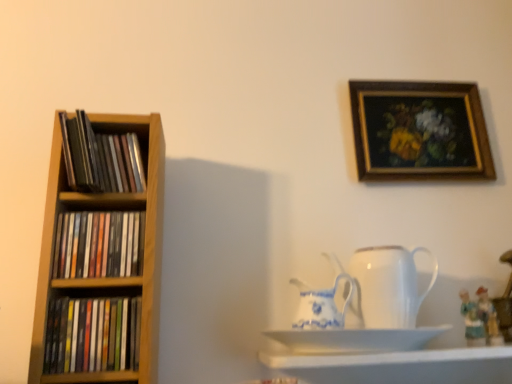
Describe the element at coordinates (93, 335) in the screenshot. I see `matte black books at left, which appears as the third book when viewed from the top` at that location.

In order to face white ceramic saucer at lower center, should I rotate leftwards or rightwards?

Rotate your view right by about 14.285°.

The width and height of the screenshot is (512, 384). What do you see at coordinates (488, 317) in the screenshot? I see `matte ceramic figurine at lower right, which appears as the 2th toy when viewed from the left` at bounding box center [488, 317].

What do you see at coordinates (320, 306) in the screenshot? This screenshot has height=384, width=512. I see `white porcelain jug at center, the 2th jug in the right-to-left sequence` at bounding box center [320, 306].

What is the approximate width of matte wooden shelf at left, which appears as the second book when viewed from the top?

The width of matte wooden shelf at left, which appears as the second book when viewed from the top, is 6.24 centimeters.

This screenshot has width=512, height=384. Describe the element at coordinates (100, 158) in the screenshot. I see `matte black books at left, the third book positioned from the bottom` at that location.

Image resolution: width=512 pixels, height=384 pixels. I want to click on matte black books at left, which ranks as the first book in bottom-to-top order, so click(x=93, y=335).

You are a GUI agent. You are given a task and a screenshot of the screen. Output one action in this format:
    pyautogui.click(x=<x>, y=<y>)
    Task: Click on the shelf that is below the white porcelain jug at center, positioned as the second jug in left-to-right order (from the image's perspective)
    This screenshot has height=384, width=512.
    Given the screenshot: What is the action you would take?
    pyautogui.click(x=398, y=366)

Could you tell me if white porcelain jug at center, which is counted as the first jug, starting from the right, is facing white glossy shelf at lower center?

No, white porcelain jug at center, which is counted as the first jug, starting from the right, does not turn towards white glossy shelf at lower center.

Is white porcelain jug at center, positioned as the second jug in left-to-right order, taller than white glossy shelf at lower center?

Correct, white porcelain jug at center, positioned as the second jug in left-to-right order, is much taller as white glossy shelf at lower center.

Would you say white glossy shelf at lower center is part of white porcelain jug at center, which is counted as the first jug, starting from the right,'s contents?

No, white glossy shelf at lower center is not a part of white porcelain jug at center, which is counted as the first jug, starting from the right.

How many degrees apart are the facing directions of wooden framed painting at upper right and matte ceramic figurine at lower right, placed as the first toy when sorted from right to left?

The angle between the facing direction of wooden framed painting at upper right and the facing direction of matte ceramic figurine at lower right, placed as the first toy when sorted from right to left, is 1.46 degrees.

Which object is positioned more to the right, wooden framed painting at upper right or matte ceramic figurine at lower right, which appears as the 2th toy when viewed from the left?

Positioned to the right is matte ceramic figurine at lower right, which appears as the 2th toy when viewed from the left.

Is matte ceramic figurine at lower right, placed as the first toy when sorted from right to left, at the back of wooden framed painting at upper right?

No.

Is matte black books at left, positioned as the first book in top-to-bottom order, taller than wooden framed painting at upper right?

In fact, matte black books at left, positioned as the first book in top-to-bottom order, may be shorter than wooden framed painting at upper right.

Considering the relative positions of matte black books at left, the third book positioned from the bottom, and wooden framed painting at upper right in the image provided, is matte black books at left, the third book positioned from the bottom, to the left of wooden framed painting at upper right from the viewer's perspective?

Yes.

Can you confirm if matte black books at left, the third book positioned from the bottom, is smaller than wooden framed painting at upper right?

Indeed, matte black books at left, the third book positioned from the bottom, has a smaller size compared to wooden framed painting at upper right.

Is matte black books at left, the third book positioned from the bottom, behind wooden framed painting at upper right?

Answer: No.

Is matte black books at left, positioned as the first book in top-to-bottom order, to the left of matte black books at left, which appears as the third book when viewed from the top, from the viewer's perspective?

In fact, matte black books at left, positioned as the first book in top-to-bottom order, is to the right of matte black books at left, which appears as the third book when viewed from the top.

From a real-world perspective, is matte black books at left, the third book positioned from the bottom, positioned over matte black books at left, which ranks as the first book in bottom-to-top order, based on gravity?

Yes, from a real-world perspective, matte black books at left, the third book positioned from the bottom, is on top of matte black books at left, which ranks as the first book in bottom-to-top order.

Is matte black books at left, the third book positioned from the bottom, wider than matte black books at left, which appears as the third book when viewed from the top?

Indeed, matte black books at left, the third book positioned from the bottom, has a greater width compared to matte black books at left, which appears as the third book when viewed from the top.

Is matte black books at left, the third book positioned from the bottom, situated inside matte black books at left, which ranks as the first book in bottom-to-top order, or outside?

matte black books at left, the third book positioned from the bottom, cannot be found inside matte black books at left, which ranks as the first book in bottom-to-top order.

From a real-world perspective, which object rests below the other?

matte ceramic figurine at lower right, which is the second toy in right-to-left order.

Does matte ceramic figurine at lower right, which is the second toy in right-to-left order, have a greater width compared to white porcelain jug at center, the 2th jug in the right-to-left sequence?

No, matte ceramic figurine at lower right, which is the second toy in right-to-left order, is not wider than white porcelain jug at center, the 2th jug in the right-to-left sequence.

From the picture: From the image's perspective, is matte ceramic figurine at lower right, which is the second toy in right-to-left order, beneath white porcelain jug at center, the first jug in the left-to-right sequence?

Correct, matte ceramic figurine at lower right, which is the second toy in right-to-left order, appears lower than white porcelain jug at center, the first jug in the left-to-right sequence, in the image.

Is the surface of matte ceramic figurine at lower right, which is the second toy in right-to-left order, in direct contact with white porcelain jug at center, the 2th jug in the right-to-left sequence?

There is a gap between matte ceramic figurine at lower right, which is the second toy in right-to-left order, and white porcelain jug at center, the 2th jug in the right-to-left sequence.

In the scene shown: Which of these two, matte ceramic figurine at lower right, which is the second toy in right-to-left order, or white ceramic saucer at lower center, is bigger?

white ceramic saucer at lower center.

The image size is (512, 384). Identify the location of saucer located in front of the matte ceramic figurine at lower right, which is the first toy in left-to-right order. (355, 339).

From a real-world perspective, which is physically above, matte ceramic figurine at lower right, which is the first toy in left-to-right order, or white ceramic saucer at lower center?

From a 3D spatial view, matte ceramic figurine at lower right, which is the first toy in left-to-right order, is above.

Is matte ceramic figurine at lower right, which is the second toy in right-to-left order, outside of white ceramic saucer at lower center?

That's correct, matte ceramic figurine at lower right, which is the second toy in right-to-left order, is outside of white ceramic saucer at lower center.

Which object is further away from the camera taking this photo, matte black books at left, which appears as the third book when viewed from the top, or matte ceramic figurine at lower right, placed as the first toy when sorted from right to left?

matte ceramic figurine at lower right, placed as the first toy when sorted from right to left, is further away from the camera.

Looking at this image, is there a large distance between matte black books at left, which appears as the third book when viewed from the top, and matte ceramic figurine at lower right, placed as the first toy when sorted from right to left?

No, there isn't a large distance between matte black books at left, which appears as the third book when viewed from the top, and matte ceramic figurine at lower right, placed as the first toy when sorted from right to left.

In the scene shown: Which of these two, matte black books at left, which appears as the third book when viewed from the top, or matte ceramic figurine at lower right, which appears as the 2th toy when viewed from the left, is bigger?

With larger size is matte black books at left, which appears as the third book when viewed from the top.

At what (x,y) coordinates should I click in order to perform the action: click on shelf below the white porcelain jug at center, positioned as the second jug in left-to-right order (from a real-world perspective). Please return your answer as a coordinate pair (x, y). The image size is (512, 384). Looking at the image, I should click on (398, 366).

From the wooden framed painting at upper right, count 2nd toy to the right and point to it. Please provide its 2D coordinates.

[(488, 317)]

Estimate the real-world distances between objects in this image. Which object is further from wooden framed painting at upper right, white ceramic saucer at lower center or white glossy shelf at lower center?

white glossy shelf at lower center is further to wooden framed painting at upper right.

Consider the image. Looking at the image, which one is located closer to white porcelain jug at center, the first jug in the left-to-right sequence, matte black books at left, which ranks as the first book in bottom-to-top order, or white ceramic saucer at lower center?

white ceramic saucer at lower center lies closer to white porcelain jug at center, the first jug in the left-to-right sequence, than the other object.

Based on their spatial positions, is matte black books at left, positioned as the first book in top-to-bottom order, or matte ceramic figurine at lower right, which is the second toy in right-to-left order, closer to white porcelain jug at center, positioned as the second jug in left-to-right order?

matte ceramic figurine at lower right, which is the second toy in right-to-left order, is closer to white porcelain jug at center, positioned as the second jug in left-to-right order.

When comparing their distances from matte black books at left, which ranks as the first book in bottom-to-top order, does matte wooden shelf at left, the 2th book when ordered from bottom to top, or matte black books at left, the third book positioned from the bottom, seem further?

Based on the image, matte black books at left, the third book positioned from the bottom, appears to be further to matte black books at left, which ranks as the first book in bottom-to-top order.

From the image, which object appears to be nearer to matte ceramic figurine at lower right, which is the second toy in right-to-left order, wooden framed painting at upper right or matte black books at left, the third book positioned from the bottom?

wooden framed painting at upper right is positioned closer to the anchor matte ceramic figurine at lower right, which is the second toy in right-to-left order.

When comparing their distances from wooden framed painting at upper right, does matte wooden shelf at left, which appears as the second book when viewed from the top, or matte ceramic figurine at lower right, placed as the first toy when sorted from right to left, seem further?

matte wooden shelf at left, which appears as the second book when viewed from the top, is further to wooden framed painting at upper right.

Based on their spatial positions, is wooden framed painting at upper right or matte black books at left, which appears as the third book when viewed from the top, further from white ceramic saucer at lower center?

The object further to white ceramic saucer at lower center is wooden framed painting at upper right.

When comparing their distances from wooden framed painting at upper right, does white porcelain jug at center, the first jug in the left-to-right sequence, or white ceramic saucer at lower center seem further?

white ceramic saucer at lower center is further to wooden framed painting at upper right.

You are a GUI agent. You are given a task and a screenshot of the screen. Output one action in this format:
    pyautogui.click(x=<x>, y=<y>)
    Task: Click on the picture frame between matte black books at left, which ranks as the first book in bottom-to-top order, and matte ceramic figurine at lower right, which is the first toy in left-to-right order
    This screenshot has width=512, height=384.
    Given the screenshot: What is the action you would take?
    pyautogui.click(x=419, y=131)

Where is `shelf located between white ceramic saucer at lower center and matte ceramic figurine at lower right, which is the second toy in right-to-left order, in the left-right direction`? The height and width of the screenshot is (384, 512). shelf located between white ceramic saucer at lower center and matte ceramic figurine at lower right, which is the second toy in right-to-left order, in the left-right direction is located at coordinates (398, 366).

You are a GUI agent. You are given a task and a screenshot of the screen. Output one action in this format:
    pyautogui.click(x=<x>, y=<y>)
    Task: Click on the shelf between white porcelain jug at center, the first jug in the left-to-right sequence, and matte ceramic figurine at lower right, which appears as the 2th toy when viewed from the left, in the horizontal direction
    
    Given the screenshot: What is the action you would take?
    pyautogui.click(x=398, y=366)

Where is `picture frame between matte black books at left, positioned as the first book in top-to-bottom order, and matte ceramic figurine at lower right, which is the first toy in left-to-right order, from left to right`? The image size is (512, 384). picture frame between matte black books at left, positioned as the first book in top-to-bottom order, and matte ceramic figurine at lower right, which is the first toy in left-to-right order, from left to right is located at coordinates (419, 131).